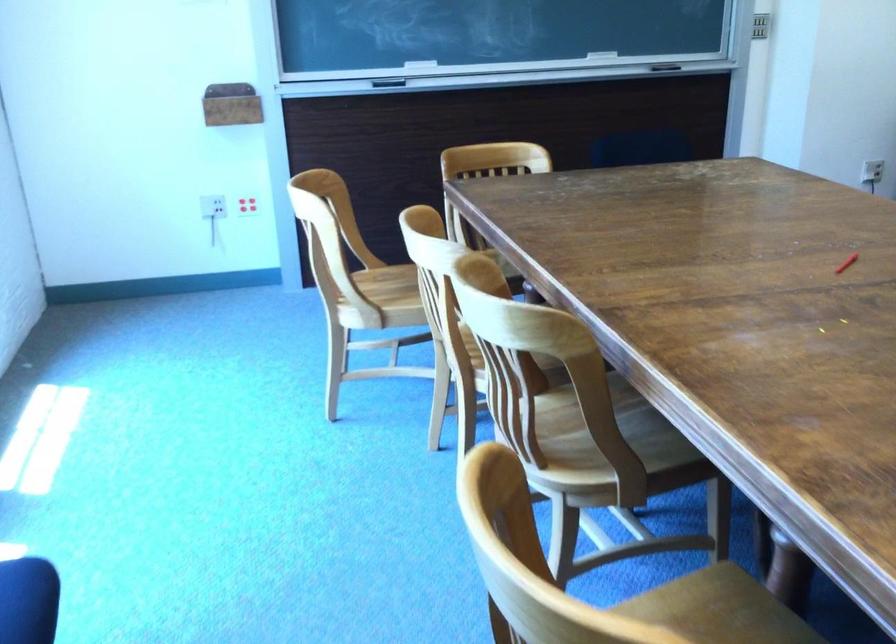
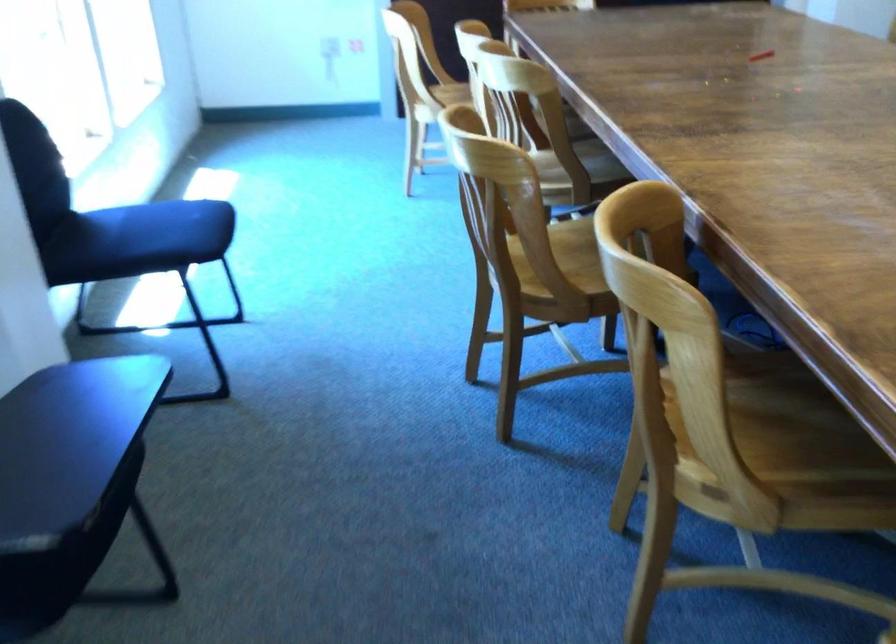
Question: Which direction would the cameraman need to move to produce the second image? Reply with the corresponding letter.

Choices:
 (A) Left
 (B) Right
 (C) Forward
 (D) Backward

Answer: (D)